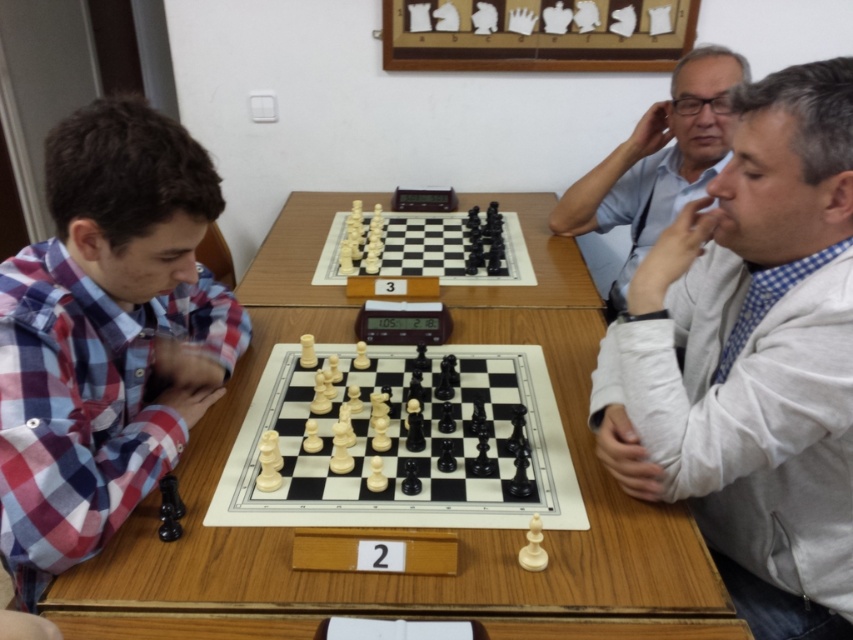
Question: Is plaid fabric shirt at left above white plastic chessboard at center?

Choices:
 (A) yes
 (B) no

Answer: (B)

Question: Is white shirt at right smaller than plaid fabric shirt at left?

Choices:
 (A) yes
 (B) no

Answer: (A)

Question: Which object appears closest to the camera in this image?

Choices:
 (A) polished wood chessboard at center
 (B) wooden table at center

Answer: (B)

Question: Which is nearer to the wooden table at center?

Choices:
 (A) white shirt at right
 (B) polished wood chessboard at center

Answer: (B)

Question: Estimate the real-world distances between objects in this image. Which object is closer to the polished wood chessboard at center?

Choices:
 (A) plaid fabric shirt at left
 (B) white shirt at right

Answer: (A)

Question: Is matte blue shirt at upper right above white plastic chess pieces at center?

Choices:
 (A) no
 (B) yes

Answer: (B)